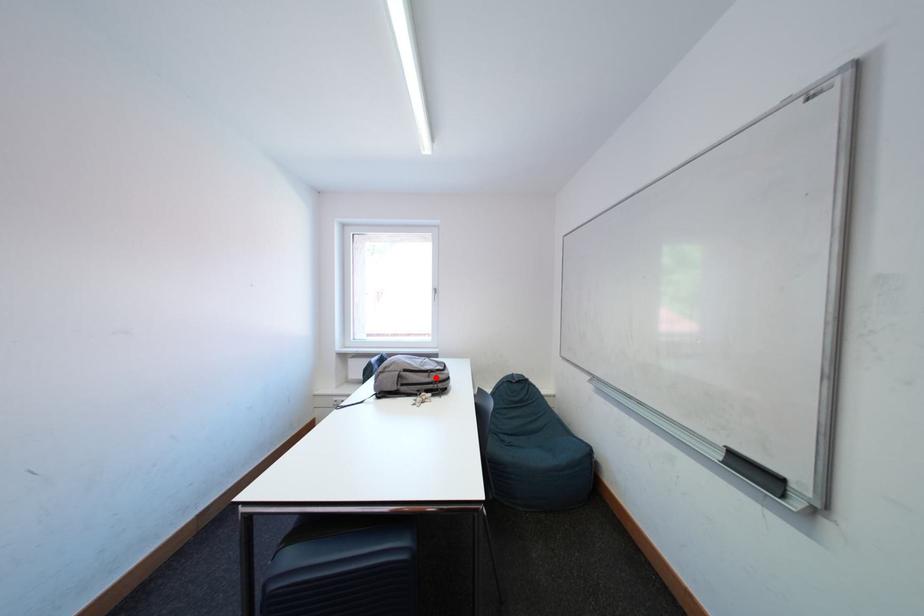
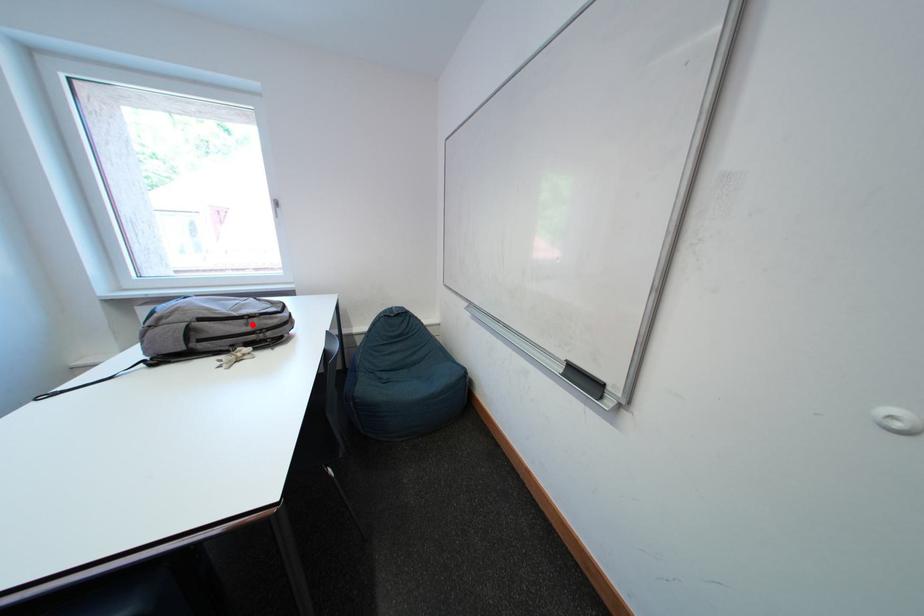
I am providing you with two images of the same scene from different viewpoints. A red point is marked on the first image and another point is marked on the second image. Is the marked point in image1 the same physical position as the marked point in image2?

Yes